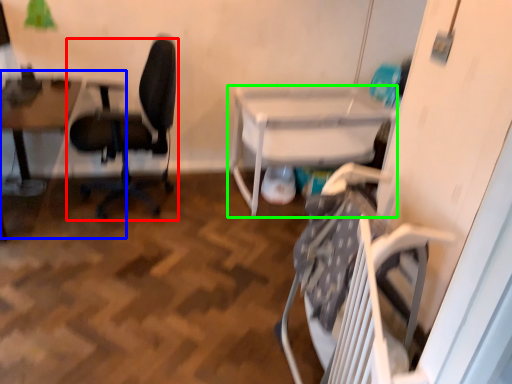
Question: Which object is the farthest from chair (highlighted by a red box)? Choose among these: table (highlighted by a blue box) or table (highlighted by a green box).

Choices:
 (A) table
 (B) table

Answer: (B)